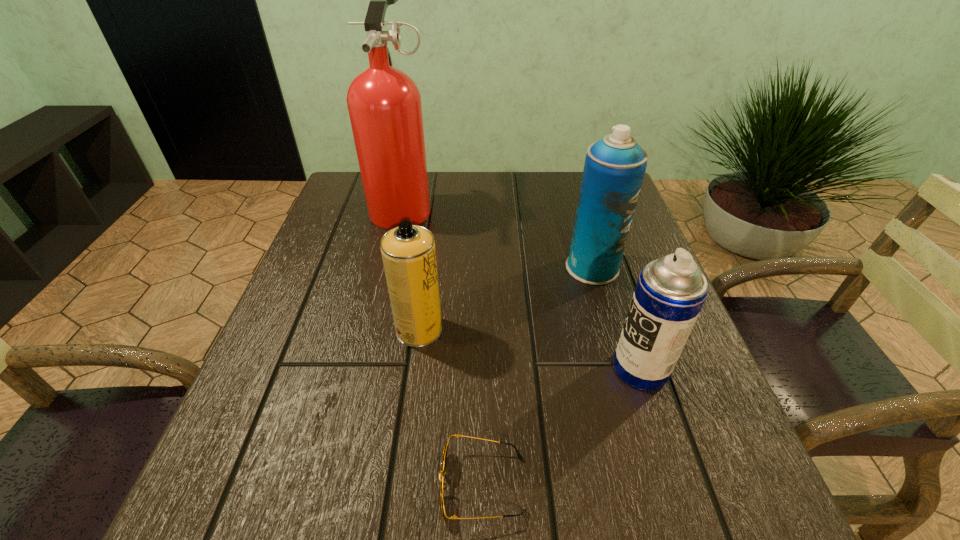
This screenshot has width=960, height=540. In order to click on the tallest object in this screenshot , I will do (x=384, y=103).

You are a GUI agent. You are given a task and a screenshot of the screen. Output one action in this format:
    pyautogui.click(x=<x>, y=<y>)
    Task: Click on the fire extinguisher
    The width and height of the screenshot is (960, 540).
    Given the screenshot: What is the action you would take?
    pyautogui.click(x=384, y=103)

The width and height of the screenshot is (960, 540). Find the location of `the second farthest object`. the second farthest object is located at coordinates (614, 168).

Where is `the farthest aerosol can`? The image size is (960, 540). the farthest aerosol can is located at coordinates (614, 168).

Where is `the leftmost aerosol can`? the leftmost aerosol can is located at coordinates (408, 251).

Locate an element on the screen. the shortest object is located at coordinates [x=443, y=486].

What are the coordinates of `sunglasses` in the screenshot? It's located at (443, 486).

The image size is (960, 540). Identify the location of free space located 0.070m on the front of the tallest object. (392, 253).

The width and height of the screenshot is (960, 540). Find the location of `vacant space situated on the front of the tallest aerosol can`. vacant space situated on the front of the tallest aerosol can is located at coordinates (641, 437).

This screenshot has width=960, height=540. What are the coordinates of `vacant space situated 0.240m on the back of the leftmost aerosol can` in the screenshot? It's located at (431, 239).